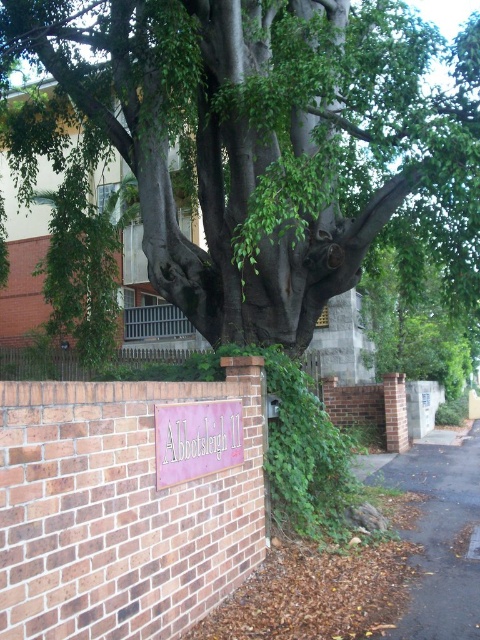
Question: Is green rough bark tree at center positioned at the back of pink matte sign at center?

Choices:
 (A) yes
 (B) no

Answer: (A)

Question: Which of the following is the closest to the observer?

Choices:
 (A) green rough bark tree at center
 (B) pink matte sign at center

Answer: (B)

Question: Is green rough bark tree at center to the left of pink matte sign at center from the viewer's perspective?

Choices:
 (A) yes
 (B) no

Answer: (B)

Question: Which of the following is the closest to the observer?

Choices:
 (A) green rough bark tree at center
 (B) pink matte sign at center

Answer: (B)

Question: Is green rough bark tree at center thinner than pink matte sign at center?

Choices:
 (A) yes
 (B) no

Answer: (B)